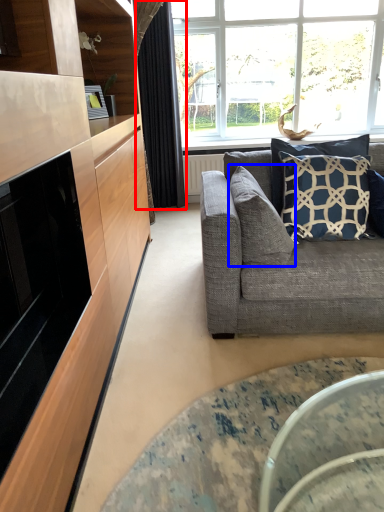
Question: Which of the following is the farthest to the observer, curtain (highlighted by a red box) or pillow (highlighted by a blue box)?

Choices:
 (A) curtain
 (B) pillow

Answer: (A)